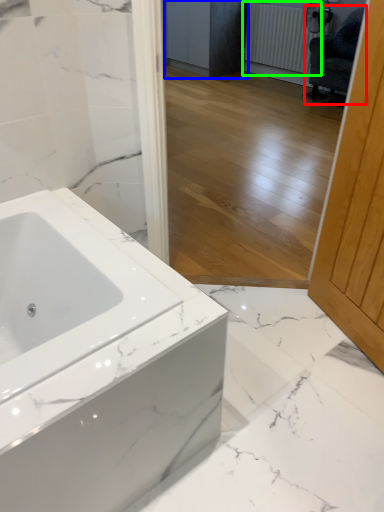
Question: Estimate the real-world distances between objects in this image. Which object is farther from swivel chair (highlighted by a red box), cabinetry (highlighted by a blue box) or radiator (highlighted by a green box)?

Choices:
 (A) cabinetry
 (B) radiator

Answer: (A)